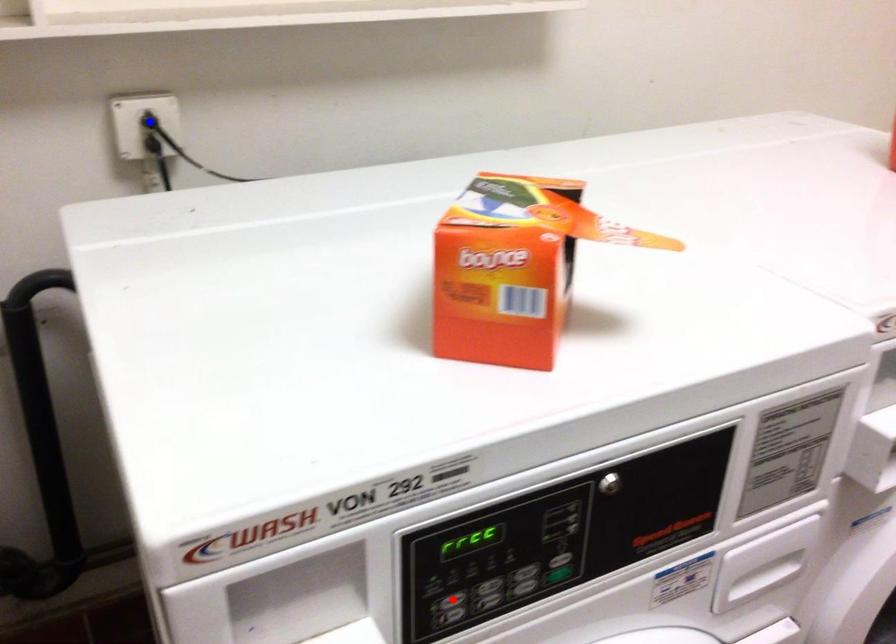
Question: In the image, two points are highlighted. Which point is nearer to the camera? Reply with the corresponding letter.

Choices:
 (A) blue point
 (B) red point

Answer: (B)